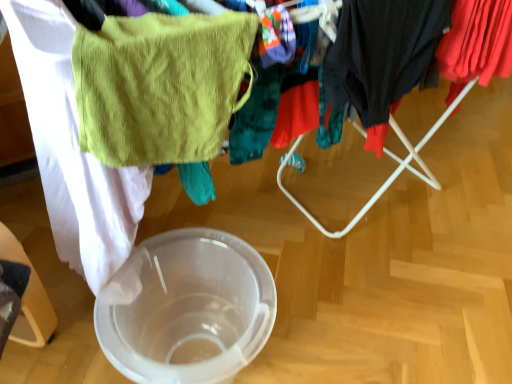
At what (x,y) coordinates should I click in order to perform the action: click on free location above green terry cloth towel at upper left (from a real-world perspective). Please return your answer as a coordinate pair (x, y). Looking at the image, I should click on (170, 18).